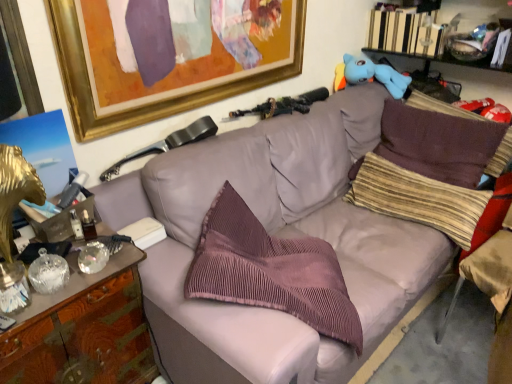
Question: Is white paper at center, which ranks as the 1th book in front-to-back order, not within blue plush toy at upper right?

Choices:
 (A) no
 (B) yes

Answer: (B)

Question: Can you confirm if white paper at center, which ranks as the 1th book in front-to-back order, is taller than blue plush toy at upper right?

Choices:
 (A) no
 (B) yes

Answer: (A)

Question: Is white paper at center, placed as the 2th book when sorted from back to front, not near blue plush toy at upper right?

Choices:
 (A) no
 (B) yes

Answer: (B)

Question: Is white paper at center, the second book from the right, thinner than blue plush toy at upper right?

Choices:
 (A) no
 (B) yes

Answer: (B)

Question: Is white paper at center, which is the first book in bottom-to-top order, in contact with blue plush toy at upper right?

Choices:
 (A) no
 (B) yes

Answer: (A)

Question: Looking at their shapes, would you say pink corduroy pillow at center, placed as the third pillow when sorted from right to left, is wider or thinner than hardcover book at upper right, which is counted as the 2th book, starting from the left?

Choices:
 (A) thin
 (B) wide

Answer: (B)

Question: Is pink corduroy pillow at center, placed as the third pillow when sorted from right to left, taller or shorter than hardcover book at upper right, which is the 2th book from front to back?

Choices:
 (A) short
 (B) tall

Answer: (B)

Question: Would you say pink corduroy pillow at center, acting as the 1th pillow starting from the left, is inside or outside hardcover book at upper right, arranged as the first book when viewed from the top?

Choices:
 (A) inside
 (B) outside

Answer: (B)

Question: From the image's perspective, is pink corduroy pillow at center, placed as the third pillow when sorted from right to left, located above or below hardcover book at upper right, the 2th book from the bottom?

Choices:
 (A) above
 (B) below

Answer: (B)

Question: From their relative heights in the image, would you say goldmaterial/texturepicture frame at upper left is taller or shorter than pink corduroy pillow at center, placed as the third pillow when sorted from right to left?

Choices:
 (A) tall
 (B) short

Answer: (B)

Question: Would you say goldmaterial/texturepicture frame at upper left is inside or outside pink corduroy pillow at center, placed as the third pillow when sorted from right to left?

Choices:
 (A) inside
 (B) outside

Answer: (B)

Question: In the image, is goldmaterial/texturepicture frame at upper left on the left side or the right side of pink corduroy pillow at center, placed as the third pillow when sorted from right to left?

Choices:
 (A) left
 (B) right

Answer: (A)

Question: From the image's perspective, is goldmaterial/texturepicture frame at upper left located above or below pink corduroy pillow at center, placed as the third pillow when sorted from right to left?

Choices:
 (A) above
 (B) below

Answer: (A)

Question: Considering the positions of point (416, 24) and point (224, 284), is point (416, 24) closer or farther from the camera than point (224, 284)?

Choices:
 (A) farther
 (B) closer

Answer: (A)

Question: Considering their positions, is hardcover book at upper right, the 2th book from the bottom, located in front of or behind pink corduroy pillow at center, acting as the 1th pillow starting from the left?

Choices:
 (A) behind
 (B) front

Answer: (A)